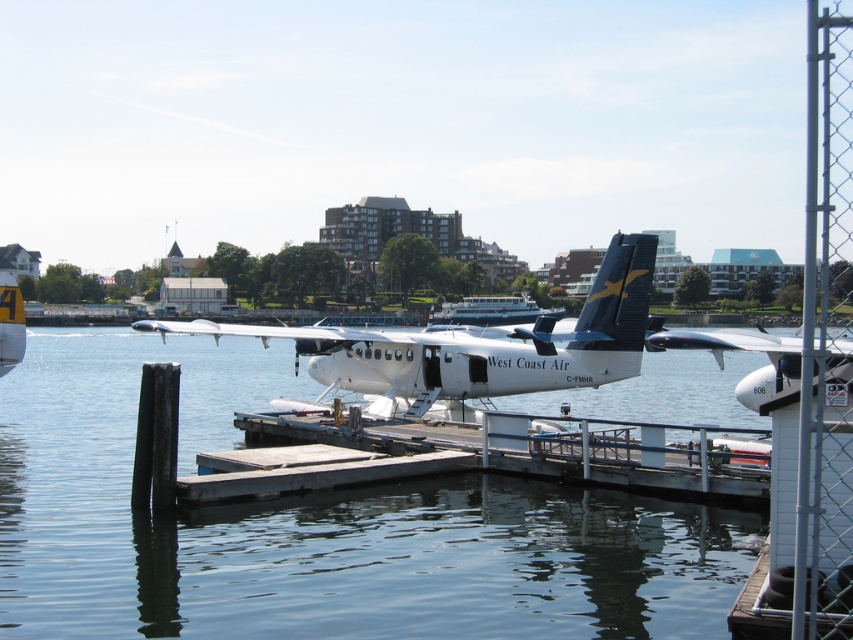
Does clear water at dock center have a lesser width compared to white matte seaplane at center?

No, clear water at dock center is not thinner than white matte seaplane at center.

Does clear water at dock center appear over white matte seaplane at center?

No.

You are a GUI agent. You are given a task and a screenshot of the screen. Output one action in this format:
    pyautogui.click(x=<x>, y=<y>)
    Task: Click on the clear water at dock center
    The image size is (853, 640).
    Given the screenshot: What is the action you would take?
    pyautogui.click(x=316, y=525)

Locate an element on the screen. clear water at dock center is located at coordinates (316, 525).

Between white matte airplane at center and white matte seaplane at center, which one appears on the left side from the viewer's perspective?

white matte airplane at center is more to the left.

Is white matte airplane at center taller than white matte seaplane at center?

Indeed, white matte airplane at center has a greater height compared to white matte seaplane at center.

Is point (492, 356) less distant than point (751, 401)?

No, it is not.

Image resolution: width=853 pixels, height=640 pixels. I want to click on white matte airplane at center, so click(x=477, y=342).

Who is lower down, clear water at dock center or white glossy boat at center?

clear water at dock center is lower down.

Can you confirm if clear water at dock center is positioned below white glossy boat at center?

Yes.

Which is in front, point (163, 604) or point (489, 321)?

Positioned in front is point (163, 604).

The height and width of the screenshot is (640, 853). I want to click on clear water at dock center, so click(316, 525).